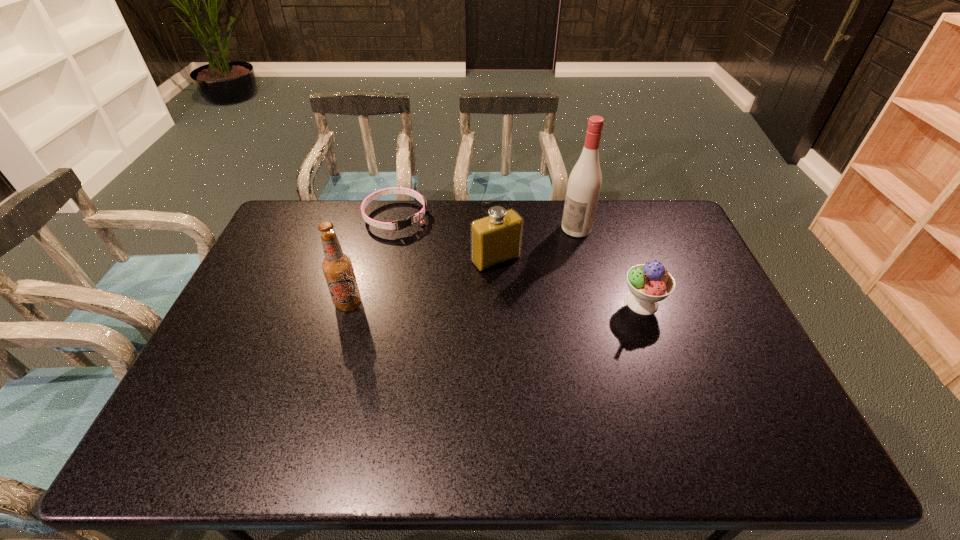
Locate an element on the screen. free point between the third tallest object and the rightmost object is located at coordinates (569, 282).

Locate an element on the screen. free space that is in between the perfume and the second object from right to left is located at coordinates (536, 245).

Locate an element on the screen. This screenshot has width=960, height=540. free space between the alcohol and the perfume is located at coordinates (536, 245).

Locate which object is the fourth closest to the perfume. Please provide its 2D coordinates. Your answer should be formatted as a tuple, i.e. [(x, y)], where the tuple contains the x and y coordinates of a point satisfying the conditions above.

[(337, 267)]

Where is `object that is the third nearest to the perfume`? Image resolution: width=960 pixels, height=540 pixels. object that is the third nearest to the perfume is located at coordinates (649, 283).

Locate an element on the screen. The height and width of the screenshot is (540, 960). vacant space that satisfies the following two spatial constraints: 1. on the front side of the third farthest object; 2. on the right side of the dog collar is located at coordinates (386, 260).

You are a GUI agent. You are given a task and a screenshot of the screen. Output one action in this format:
    pyautogui.click(x=<x>, y=<y>)
    Task: Click on the free point that satisfies the following two spatial constraints: 1. on the front label of the rightmost object; 2. on the left side of the fourth shortest object
    The image size is (960, 540).
    Given the screenshot: What is the action you would take?
    pyautogui.click(x=348, y=303)

Identify the location of free spot that satisfies the following two spatial constraints: 1. on the front side of the rightmost object; 2. on the right side of the dog collar. Image resolution: width=960 pixels, height=540 pixels. (375, 303).

The height and width of the screenshot is (540, 960). In order to click on free space in the image that satisfies the following two spatial constraints: 1. on the front side of the shortest object; 2. on the left side of the second shortest object in this screenshot , I will do `click(375, 303)`.